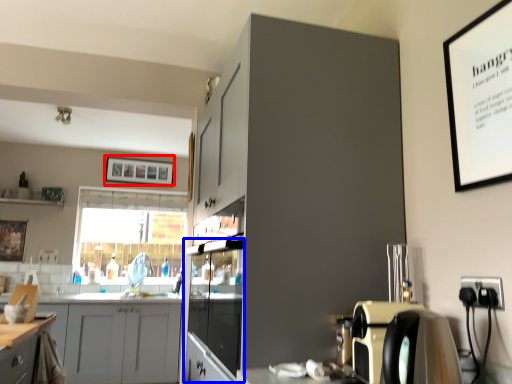
Question: Which of the following is the farthest to the observer, picture frame (highlighted by a red box) or glass door (highlighted by a blue box)?

Choices:
 (A) picture frame
 (B) glass door

Answer: (A)